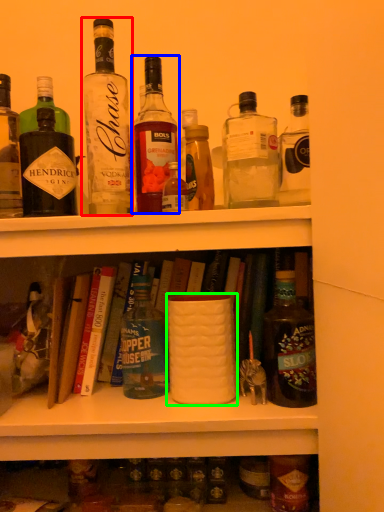
Question: Considering the real-world distances, which object is closest to bottle (highlighted by a red box)? bottle (highlighted by a blue box) or coffee cup (highlighted by a green box).

Choices:
 (A) bottle
 (B) coffee cup

Answer: (A)